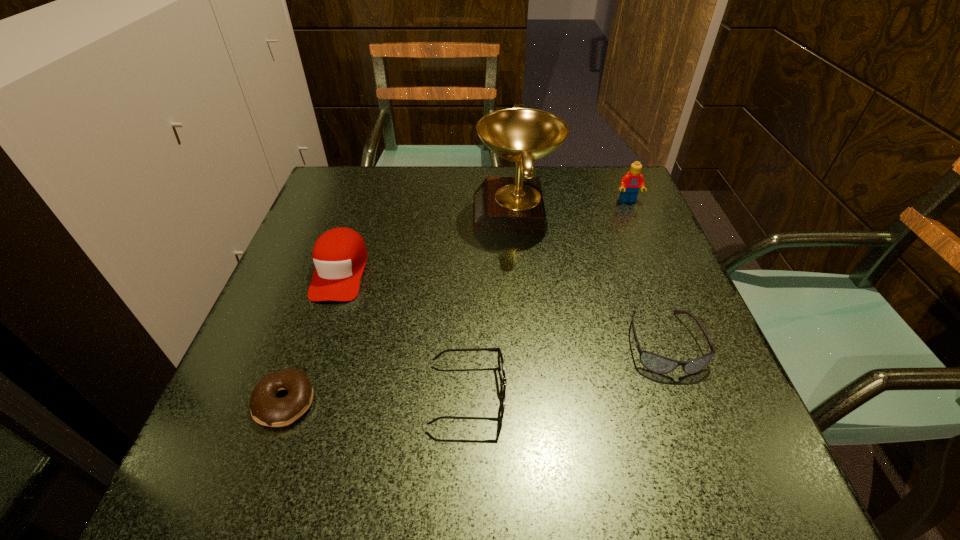
Identify the location of vacant space located 0.120m on the front-facing side of the baseball cap. This screenshot has width=960, height=540. (313, 354).

I want to click on free space located on the lenses of the sunglasses, so click(723, 503).

Locate an element on the screen. The height and width of the screenshot is (540, 960). vacant region located on the front-facing side of the spectacles is located at coordinates click(561, 395).

The height and width of the screenshot is (540, 960). I want to click on free space located on the back of the doughnut, so click(x=346, y=230).

Locate an element on the screen. This screenshot has width=960, height=540. award present at the far edge is located at coordinates (501, 205).

At what (x,y) coordinates should I click in order to perform the action: click on Lego that is positioned at the far edge. Please return your answer as a coordinate pair (x, y). Image resolution: width=960 pixels, height=540 pixels. Looking at the image, I should click on (630, 184).

Find the location of `baseball cap positioned at the left edge`. baseball cap positioned at the left edge is located at coordinates (339, 255).

You are a GUI agent. You are given a task and a screenshot of the screen. Output one action in this format:
    pyautogui.click(x=<x>, y=<y>)
    Task: Click on the doughnut located in the left edge section of the desktop
    The width and height of the screenshot is (960, 540).
    Given the screenshot: What is the action you would take?
    pyautogui.click(x=266, y=409)

Where is `Lego that is positioned at the right edge`? The height and width of the screenshot is (540, 960). Lego that is positioned at the right edge is located at coordinates (630, 184).

Image resolution: width=960 pixels, height=540 pixels. What are the coordinates of `sunglasses located at the right edge` in the screenshot? It's located at (658, 364).